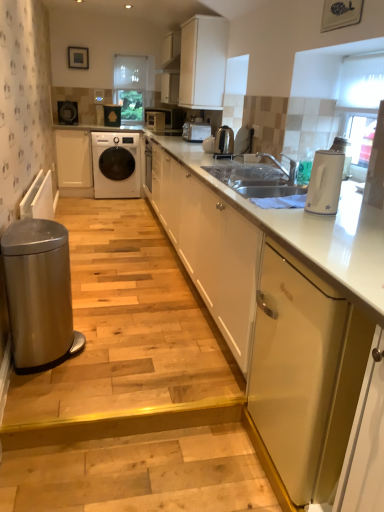
Find the location of a particular element. The width and height of the screenshot is (384, 512). vacant space positioned to the left of metallic silver toaster at upper center, which ranks as the first appliance in right-to-left order is located at coordinates (192, 151).